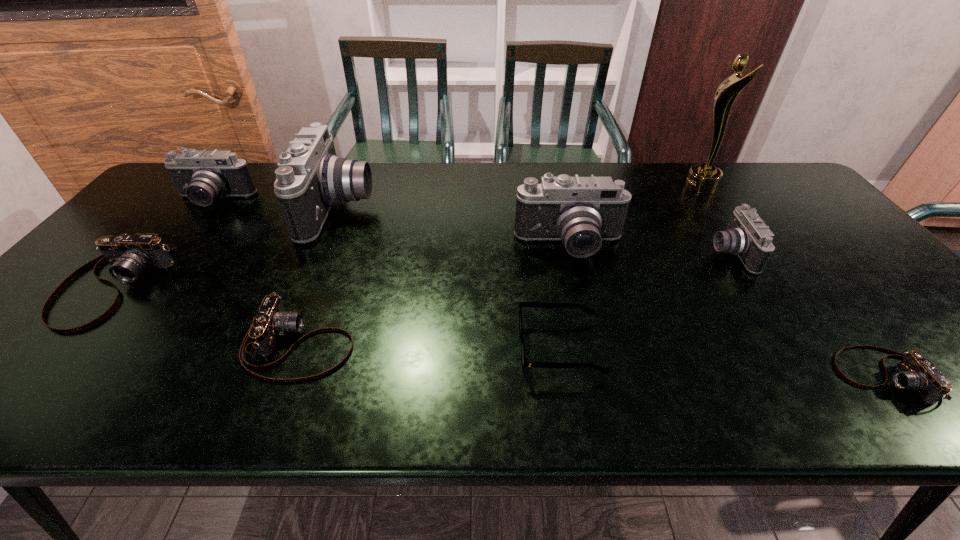
You are a GUI agent. You are given a task and a screenshot of the screen. Output one action in this format:
    pyautogui.click(x=<x>, y=<y>)
    Task: Click on the vacant area in the image that satisfies the following two spatial constraints: 1. on the front-facing side of the third smallest black camera; 2. on the front-facing side of the second brown camera from right to left
    The width and height of the screenshot is (960, 540).
    Given the screenshot: What is the action you would take?
    pyautogui.click(x=592, y=344)